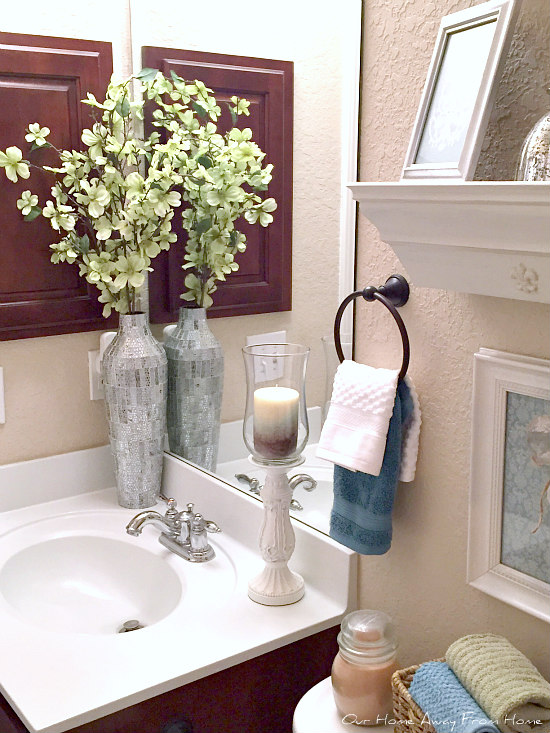
Find the location of a particular element. This screenshot has width=550, height=733. vase is located at coordinates (142, 419).